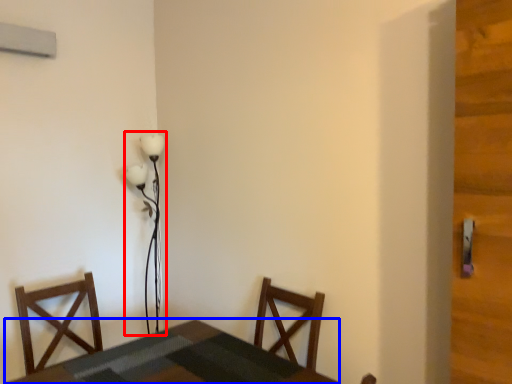
Question: Which object appears farthest to the camera in this image, lamp (highlighted by a red box) or table (highlighted by a blue box)?

Choices:
 (A) lamp
 (B) table

Answer: (A)